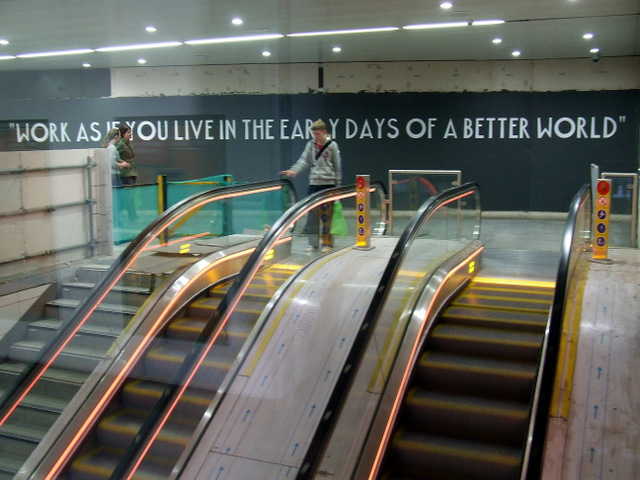
Identify the location of glass pane. (406, 188), (630, 210), (180, 192), (136, 205).